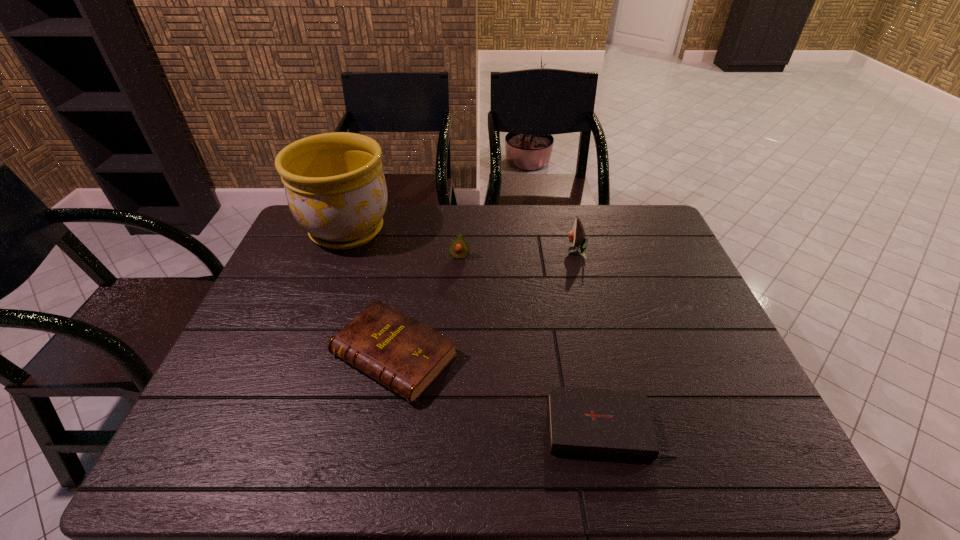
Locate an element on the screen. the tallest object is located at coordinates (335, 187).

Identify the location of the taller avocado. Image resolution: width=960 pixels, height=540 pixels. (576, 236).

This screenshot has width=960, height=540. Find the location of `the right avocado`. the right avocado is located at coordinates (576, 236).

Identify the location of the left avocado. The image size is (960, 540). (459, 249).

Identify the location of the shorter avocado. This screenshot has height=540, width=960. (459, 249).

You are a GUI agent. You are given a task and a screenshot of the screen. Output one action in this format:
    pyautogui.click(x=<x>, y=<y>)
    Task: Click on the fourth tallest object
    
    Given the screenshot: What is the action you would take?
    pyautogui.click(x=406, y=356)

Find the location of a particular element. The height and width of the screenshot is (540, 960). Bible is located at coordinates (603, 423).

Locate an element on the screen. Image resolution: width=960 pixels, height=540 pixels. free space located on the right of the flowerpot is located at coordinates (408, 231).

The height and width of the screenshot is (540, 960). In order to click on vacant space located on the seed side of the taller avocado in this screenshot , I will do `click(482, 251)`.

Locate an element on the screen. The height and width of the screenshot is (540, 960). vacant space situated on the seed side of the taller avocado is located at coordinates (532, 251).